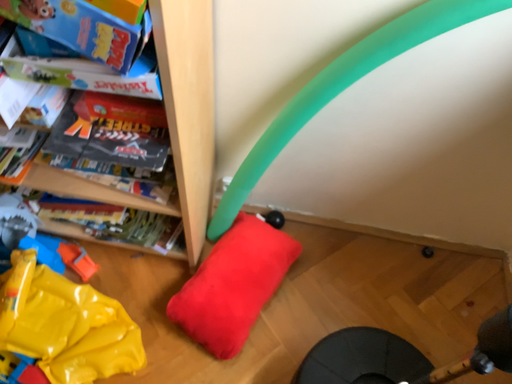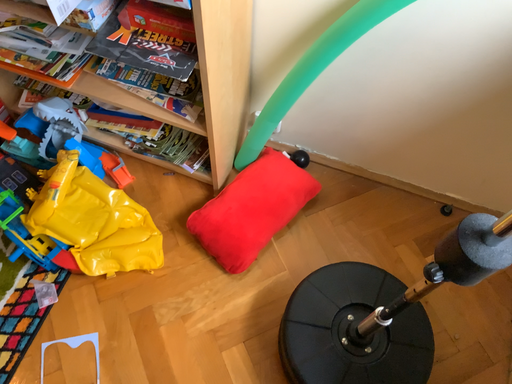
Question: Which way did the camera rotate in the video?

Choices:
 (A) rotated left
 (B) rotated right

Answer: (A)